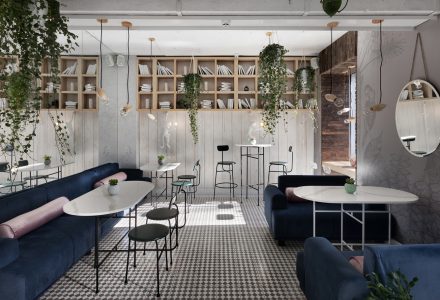
Identify the location of potted plants. (350, 181), (388, 277), (111, 180), (161, 154), (46, 160).